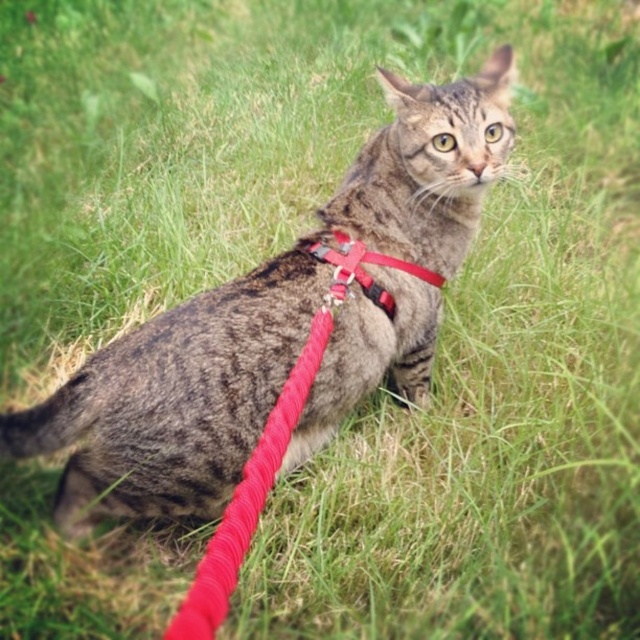
Between tabby fur cat at center and matte red harness at center, which one has more height?

tabby fur cat at center

At what (x,y) coordinates should I click in order to perform the action: click on tabby fur cat at center. Please return your answer as a coordinate pair (x, y). Looking at the image, I should click on (262, 317).

This screenshot has width=640, height=640. I want to click on tabby fur cat at center, so click(x=262, y=317).